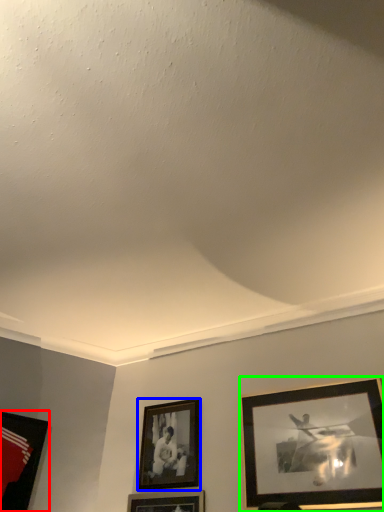
Question: Based on their relative distances, which object is farther from picture frame (highlighted by a red box)? Choose from picture frame (highlighted by a blue box) and picture frame (highlighted by a green box).

Choices:
 (A) picture frame
 (B) picture frame

Answer: (B)